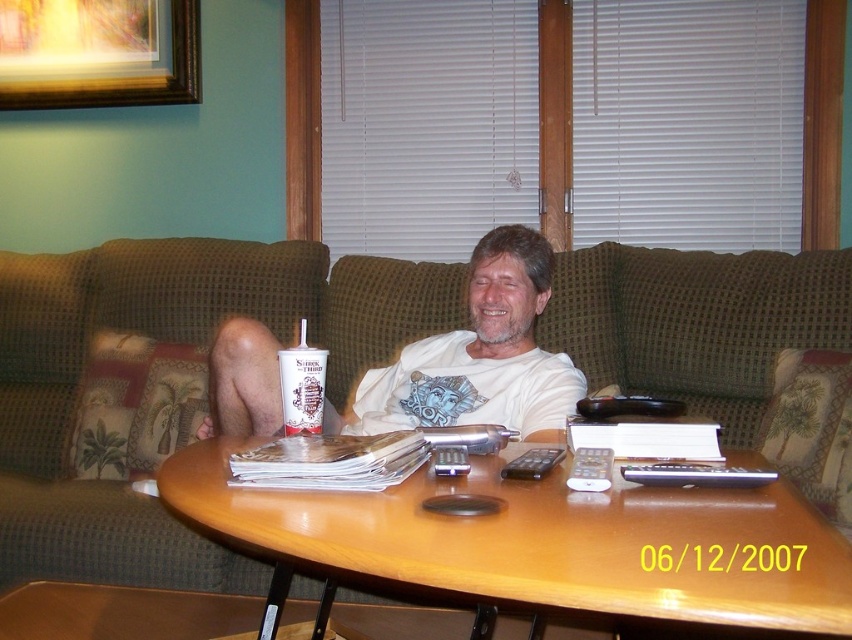
Question: Estimate the real-world distances between objects in this image. Which object is closer to the black plastic remote at center?

Choices:
 (A) brown wood table at center
 (B) silver metallic remote at center
 (C) white t-shirt at center

Answer: (B)

Question: Based on their relative distances, which object is farther from the black plastic remote at center?

Choices:
 (A) brown wood table at center
 (B) white t-shirt at center
 (C) silver metallic remote at center

Answer: (B)

Question: Considering the relative positions of silver metallic remote at center and black plastic remote at center in the image provided, where is silver metallic remote at center located with respect to black plastic remote at center?

Choices:
 (A) above
 (B) below

Answer: (A)

Question: Does silver metallic remote at center come behind black plastic remote at center?

Choices:
 (A) no
 (B) yes

Answer: (A)

Question: Considering the relative positions of green textured couch at center and brown wood table at center in the image provided, where is green textured couch at center located with respect to brown wood table at center?

Choices:
 (A) above
 (B) below

Answer: (A)

Question: Which of these objects is positioned closest to the brown wood table at center?

Choices:
 (A) black plastic remote at center
 (B) green textured couch at center
 (C) silver metallic remote at center

Answer: (A)